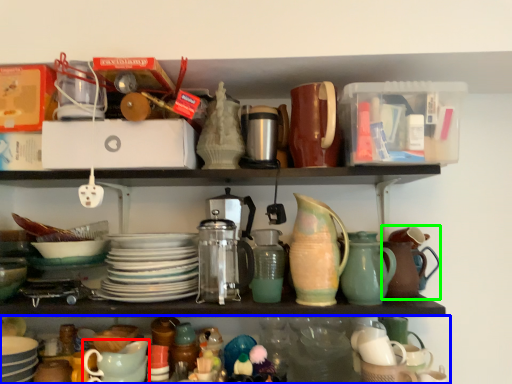
Question: Based on their relative distances, which object is nearer to tableware (highlighted by a red box)? Choose from shelf (highlighted by a blue box) and tea pot (highlighted by a green box).

Choices:
 (A) shelf
 (B) tea pot

Answer: (A)